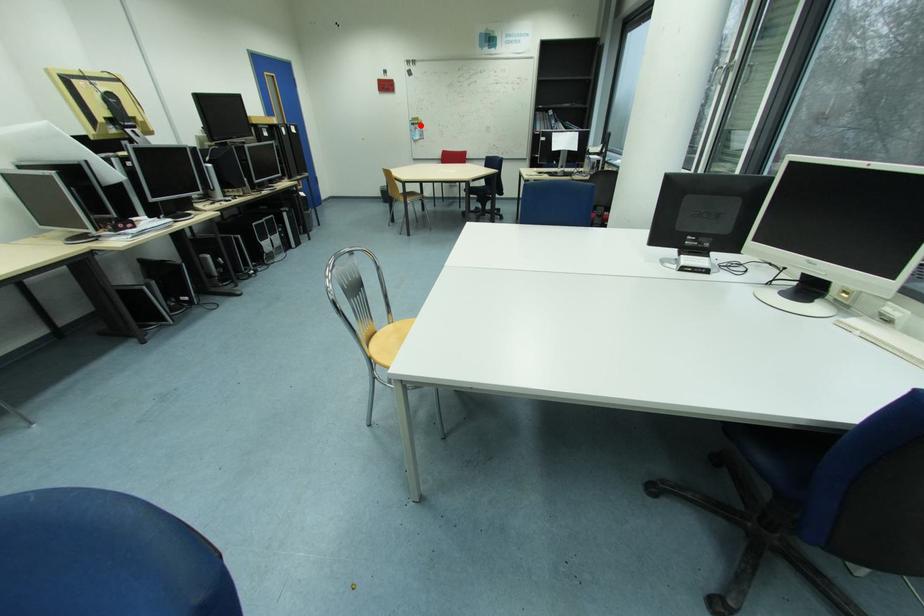
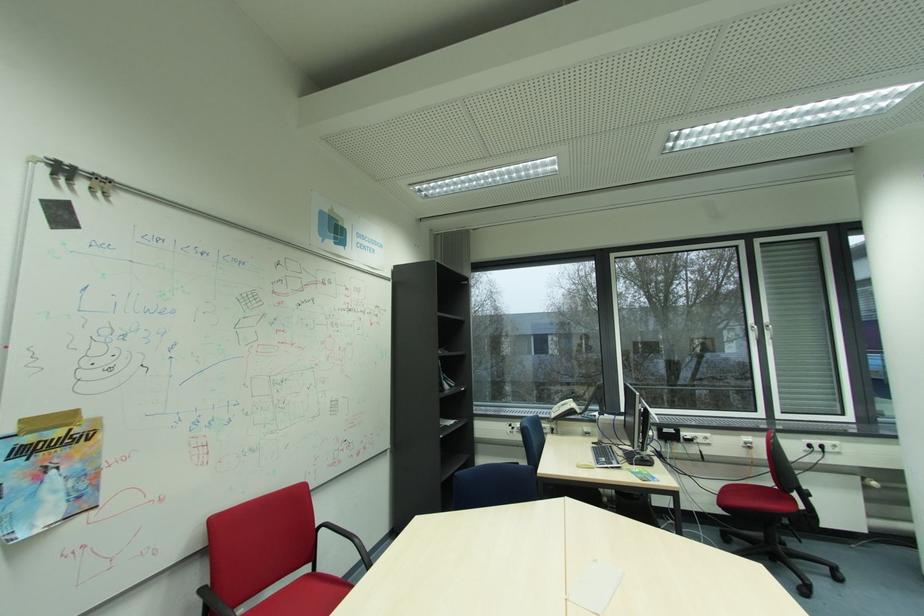
Question: I am providing you with two images of the same scene from different viewpoints. Given a red point in image1, look at the same physical point in image2. Is it:

Choices:
 (A) Closer to the viewpoint
 (B) Farther from the viewpoint

Answer: (B)